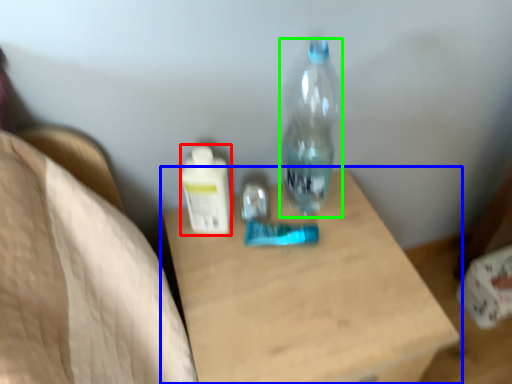
Question: Considering the real-world distances, which object is closest to bottle (highlighted by a red box)? table (highlighted by a blue box) or bottle (highlighted by a green box).

Choices:
 (A) table
 (B) bottle

Answer: (B)